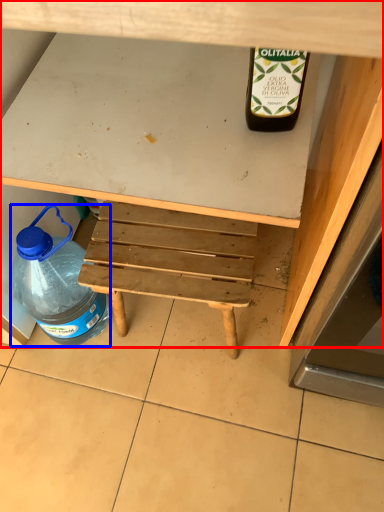
Question: Which point is closer to the camera, desk (highlighted by a red box) or bottle (highlighted by a blue box)?

Choices:
 (A) desk
 (B) bottle

Answer: (A)